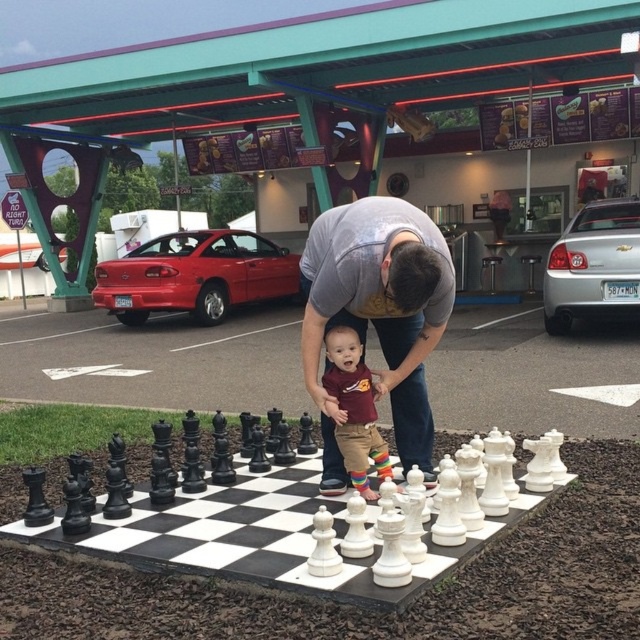
Is point (378, 296) positioned in front of point (260, 253)?

Yes, it is in front of point (260, 253).

From the picture: Who is more distant from viewer, (385, 336) or (195, 317)?

Positioned behind is point (195, 317).

Is point (314, 248) less distant than point (156, 289)?

Yes, point (314, 248) is closer to viewer.

I want to click on gray cotton shirt at center, so click(378, 312).

Does metallic red car at center-left have a lesser height compared to maroon jersey at center?

Incorrect, metallic red car at center-left's height does not fall short of maroon jersey at center's.

Can you confirm if metallic red car at center-left is positioned below maroon jersey at center?

No, metallic red car at center-left is not below maroon jersey at center.

Is point (282, 296) positioned in front of point (358, 451)?

No.

Where is `metallic red car at center-left`? The image size is (640, 640). metallic red car at center-left is located at coordinates (195, 275).

Does black stone chess set at center have a smaller size compared to maroon jersey at center?

No, black stone chess set at center is not smaller than maroon jersey at center.

Measure the distance between black stone chess set at center and maroon jersey at center.

black stone chess set at center is 51.70 centimeters from maroon jersey at center.

Does point (17, 518) come farther from viewer compared to point (385, 474)?

That is False.

The image size is (640, 640). What are the coordinates of `black stone chess set at center` in the screenshot? It's located at click(x=308, y=524).